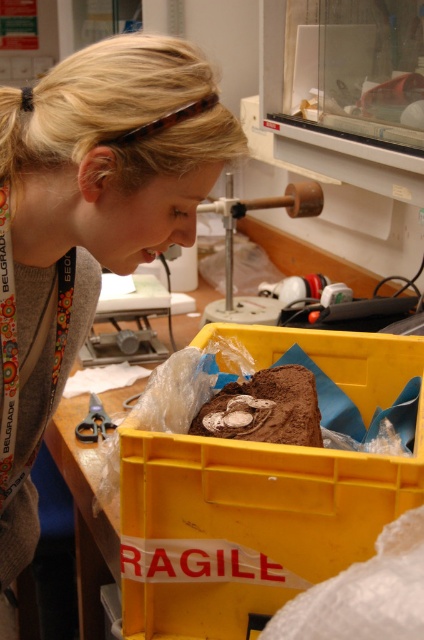
Question: Does yellow plastic crate at lower center have a greater width compared to wooden handle at upper center?

Choices:
 (A) no
 (B) yes

Answer: (B)

Question: Estimate the real-world distances between objects in this image. Which object is closer to the brushed metal scale at center?

Choices:
 (A) wooden handle at upper center
 (B) chocolate cake at center

Answer: (A)

Question: Does yellow plastic crate at lower center have a lesser width compared to brushed metal scale at center?

Choices:
 (A) yes
 (B) no

Answer: (B)

Question: Which point is closer to the camera taking this photo?

Choices:
 (A) (92, 406)
 (B) (150, 355)
 (C) (141, 465)

Answer: (C)

Question: Is wooden handle at upper center bigger than metallic scissors at lower left?

Choices:
 (A) no
 (B) yes

Answer: (B)

Question: Based on their relative distances, which object is nearer to the blonde hair at upper left?

Choices:
 (A) yellow plastic crate at lower center
 (B) chocolate cake at center
 (C) wooden handle at upper center
 (D) metallic scissors at lower left

Answer: (A)